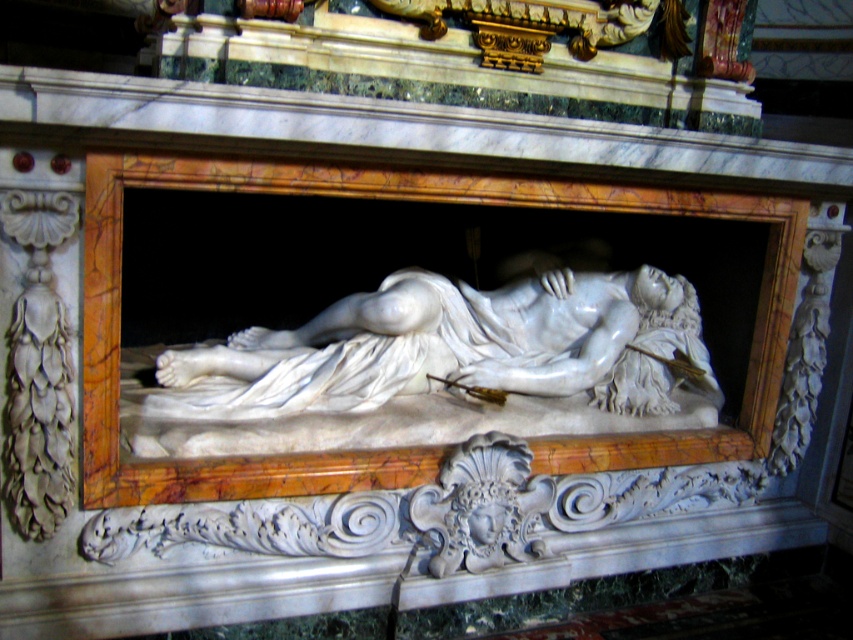
You are an art conservator examining the white marble statue at center and the white marble mask at center. Which object is positioned closer to your viewpoint?

The white marble statue at center is closer to the viewer than the white marble mask at center.

You are an art curator examining the marble sculpture. You notice a specific point labeled as point (451, 348). Where is this point located in relation to the white marble statue at center?

The point (451, 348) is located at the center of the white marble statue at center.